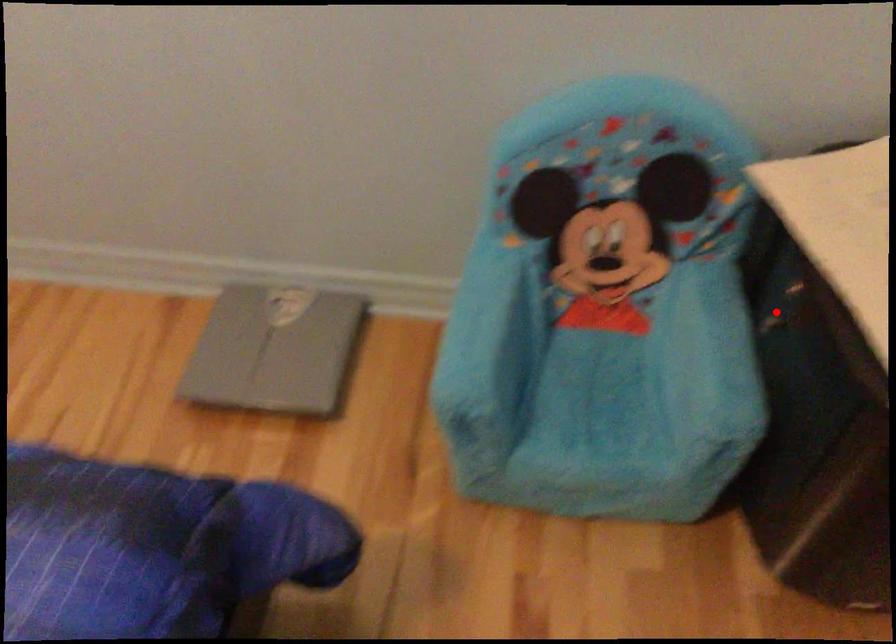
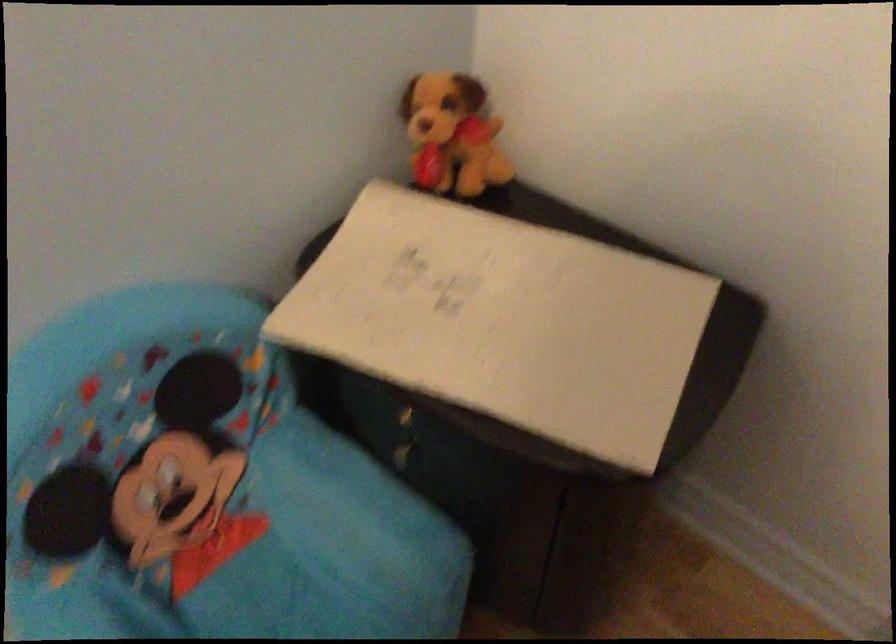
Question: I am providing you with two images of the same scene from different viewpoints. Given a red point in image1, look at the same physical point in image2. Is it:

Choices:
 (A) Closer to the viewpoint
 (B) Farther from the viewpoint

Answer: (A)